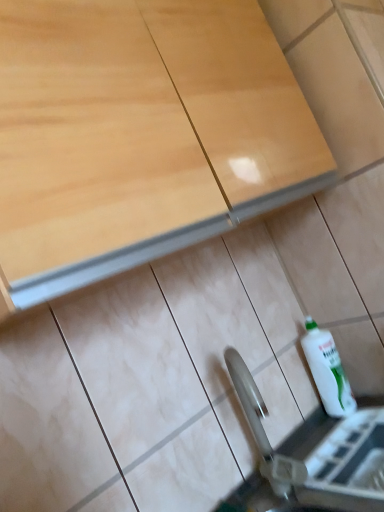
Question: Does metallic silver sink at lower center turn towards white glossy bottle at lower right?

Choices:
 (A) yes
 (B) no

Answer: (B)

Question: Is metallic silver sink at lower center in front of white glossy bottle at lower right?

Choices:
 (A) yes
 (B) no

Answer: (A)

Question: Is metallic silver sink at lower center turned away from white glossy bottle at lower right?

Choices:
 (A) no
 (B) yes

Answer: (A)

Question: Is metallic silver sink at lower center not close to white glossy bottle at lower right?

Choices:
 (A) no
 (B) yes

Answer: (A)

Question: Is white glossy bottle at lower right located within metallic silver sink at lower center?

Choices:
 (A) yes
 (B) no

Answer: (B)

Question: Can you confirm if metallic silver sink at lower center is positioned to the left of white glossy bottle at lower right?

Choices:
 (A) no
 (B) yes

Answer: (A)

Question: From a real-world perspective, is matte wood cabinet at upper center physically above white glossy bottle at lower right?

Choices:
 (A) yes
 (B) no

Answer: (A)

Question: Does matte wood cabinet at upper center come behind white glossy bottle at lower right?

Choices:
 (A) no
 (B) yes

Answer: (A)

Question: Would you say matte wood cabinet at upper center contains white glossy bottle at lower right?

Choices:
 (A) no
 (B) yes

Answer: (A)

Question: Is matte wood cabinet at upper center outside of white glossy bottle at lower right?

Choices:
 (A) no
 (B) yes

Answer: (B)

Question: Is matte wood cabinet at upper center thinner than white glossy bottle at lower right?

Choices:
 (A) no
 (B) yes

Answer: (A)

Question: Can you confirm if matte wood cabinet at upper center is shorter than white glossy bottle at lower right?

Choices:
 (A) yes
 (B) no

Answer: (B)

Question: Is matte wood cabinet at upper center oriented away from metallic silver sink at lower center?

Choices:
 (A) yes
 (B) no

Answer: (B)